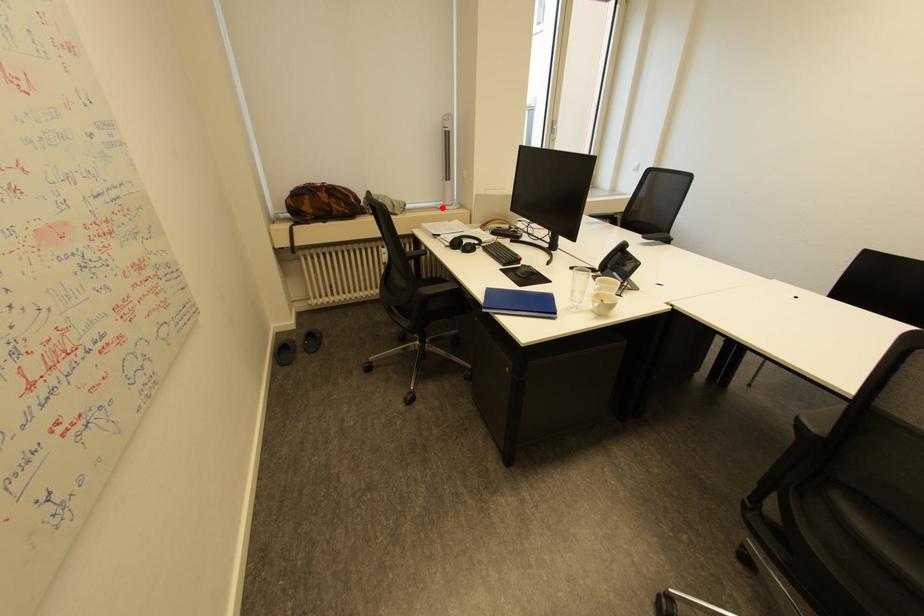
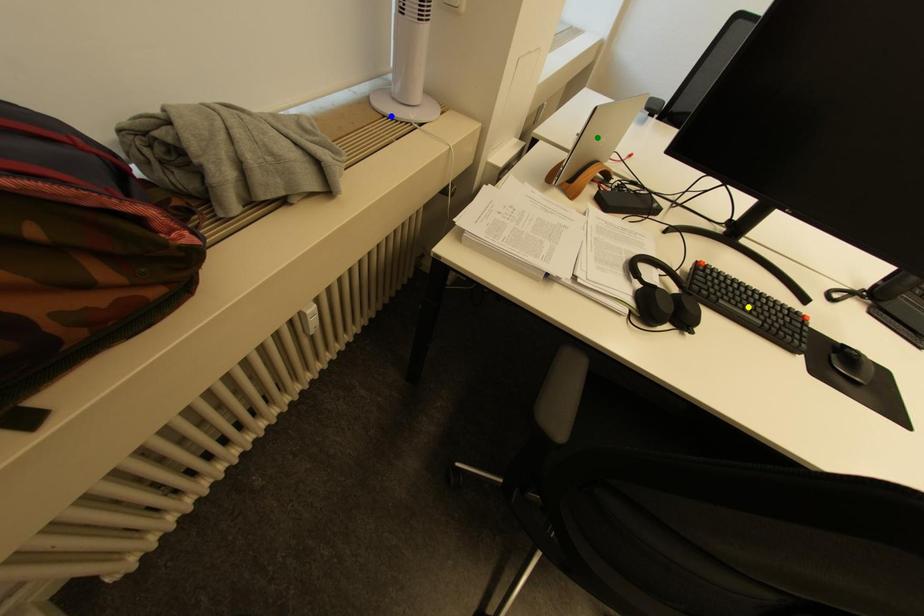
Question: I am providing you with two images of the same scene from different viewpoints. A red point is marked on the first image. You are given multiple points on the second image. In image 2, which mark is for the same physical point as the one in image 1?

Choices:
 (A) green point
 (B) blue point
 (C) yellow point

Answer: (B)